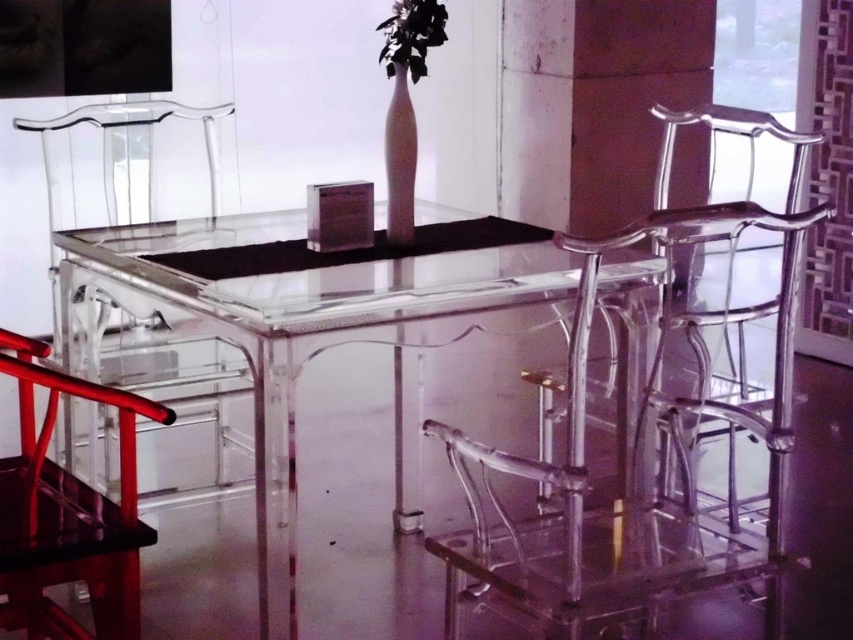
Question: Does transparent acrylic chair at center appear under transparent acrylic chair at lower left?

Choices:
 (A) no
 (B) yes

Answer: (A)

Question: Which point is closer to the camera?

Choices:
 (A) (659, 593)
 (B) (19, 356)
 (C) (410, 132)
 (D) (421, 28)

Answer: (A)

Question: Which of the following is the closest to the observer?

Choices:
 (A) black matte flower at upper center
 (B) transparent acrylic table at center

Answer: (B)

Question: Does transparent acrylic table at center appear under transparent acrylic chair at left?

Choices:
 (A) yes
 (B) no

Answer: (A)

Question: Which object is closer to the camera taking this photo?

Choices:
 (A) transparent acrylic table at center
 (B) white glossy vase at center
 (C) transparent acrylic chair at left
 (D) transparent acrylic chair at lower left

Answer: (D)

Question: Can you confirm if transparent acrylic chair at right is positioned above transparent acrylic chair at lower left?

Choices:
 (A) no
 (B) yes

Answer: (B)